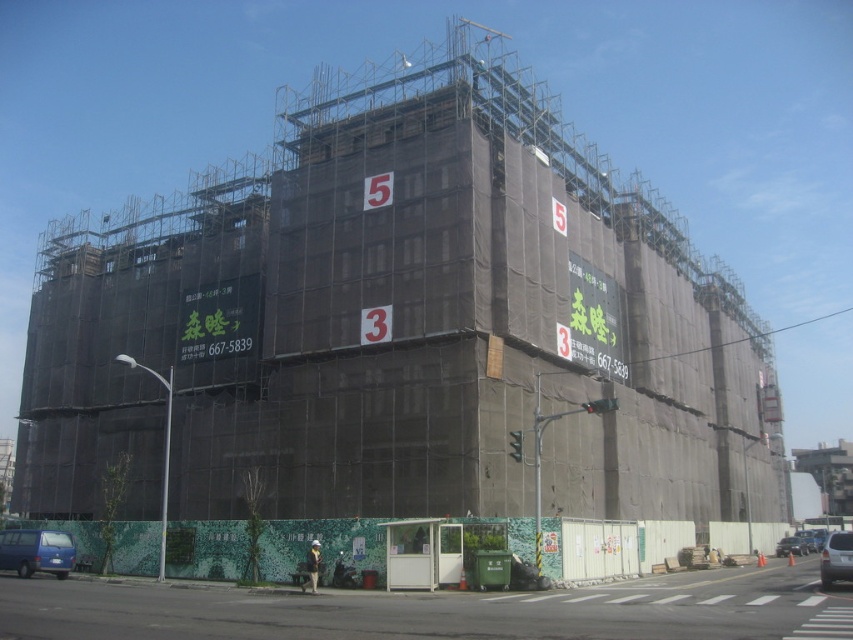
Based on the photo, you are a construction worker standing at the entrance of the building. You notice two points marked on the scaffolding. One is at coordinate point [38,556] and the other at point [799,547]. Which point is closer to you?

Point [38,556] is closer to the viewer than point [799,547].

You are a delivery driver arriving at the construction site. You need to park your vehicle but there is limited space. You see a blue matte van at lower left and a metallic blue car at lower right. Which vehicle is blocking the entrance more?

The blue matte van at lower left is blocking the entrance more because it is in front of the metallic blue car at lower right, meaning it is closer to the entrance area.